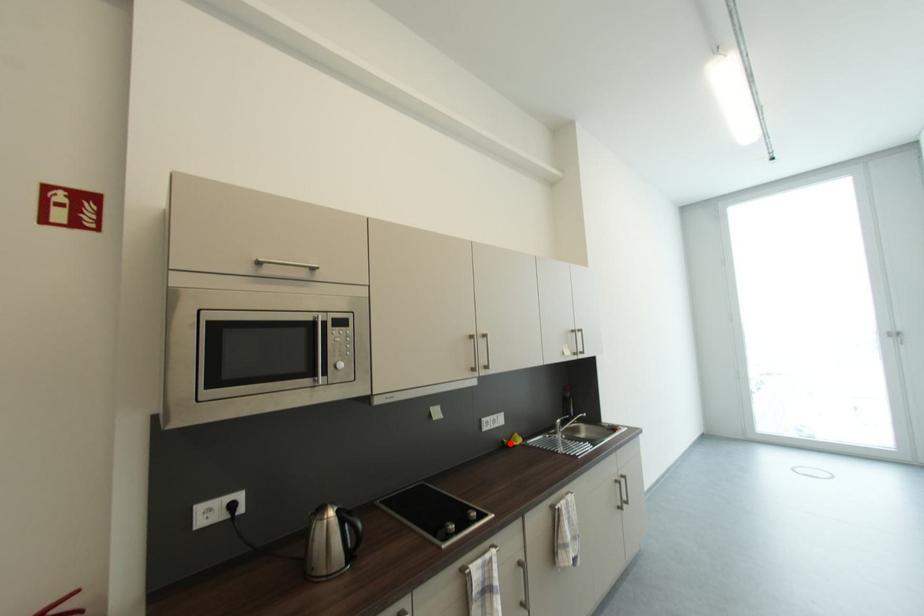
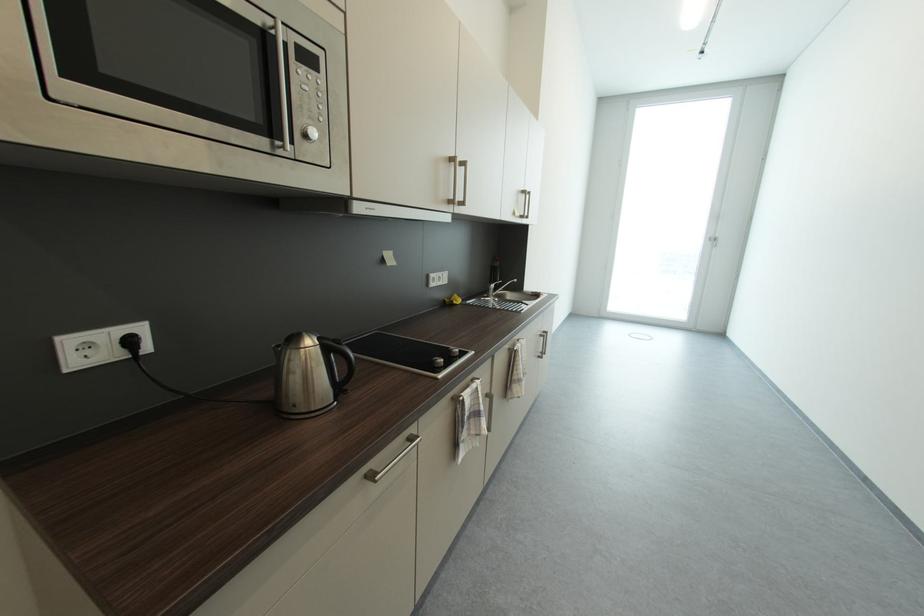
Question: A red point is marked in image1. In image2, is the corresponding 3D point closer to the camera or farther? Reply with the corresponding letter.

Choices:
 (A) The corresponding 3D point is closer.
 (B) The corresponding 3D point is farther.

Answer: (A)